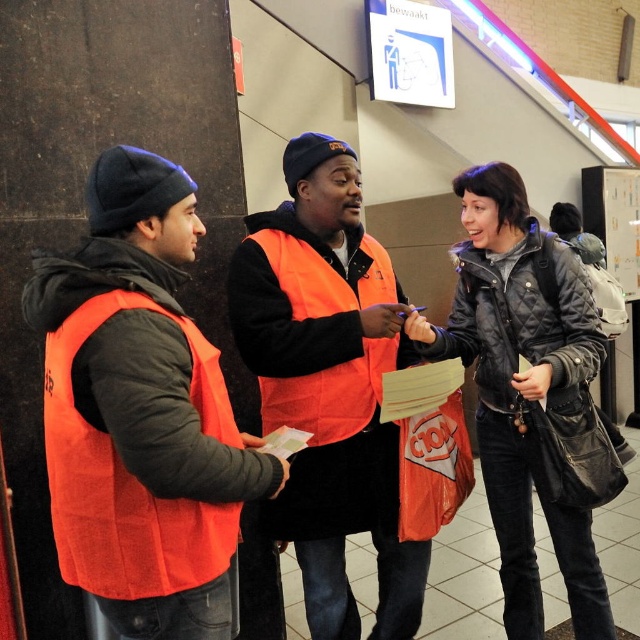
Can you confirm if orange vest at center is taller than orange fabric safety vest at left?

Yes, orange vest at center is taller than orange fabric safety vest at left.

Can you confirm if orange vest at center is smaller than orange fabric safety vest at left?

No, orange vest at center is not smaller than orange fabric safety vest at left.

The width and height of the screenshot is (640, 640). Identify the location of orange vest at center. (328, 396).

Is point (90, 490) positioned before point (355, 486)?

Yes, it is in front of point (355, 486).

Is matte orange vest at left above orange vest at center?

Yes, matte orange vest at left is above orange vest at center.

Between point (196, 371) and point (392, 323), which one is positioned behind?

Point (392, 323)

Where is `matte orange vest at left`? matte orange vest at left is located at coordinates (141, 413).

The width and height of the screenshot is (640, 640). What do you see at coordinates (141, 413) in the screenshot?
I see `matte orange vest at left` at bounding box center [141, 413].

Between point (40, 278) and point (186, 529), which one is positioned behind?

The point (40, 278) is more distant.

Who is more distant from viewer, (x=179, y=516) or (x=131, y=490)?

The point (x=179, y=516) is behind.

Identify the location of matte orange vest at left. The height and width of the screenshot is (640, 640). (141, 413).